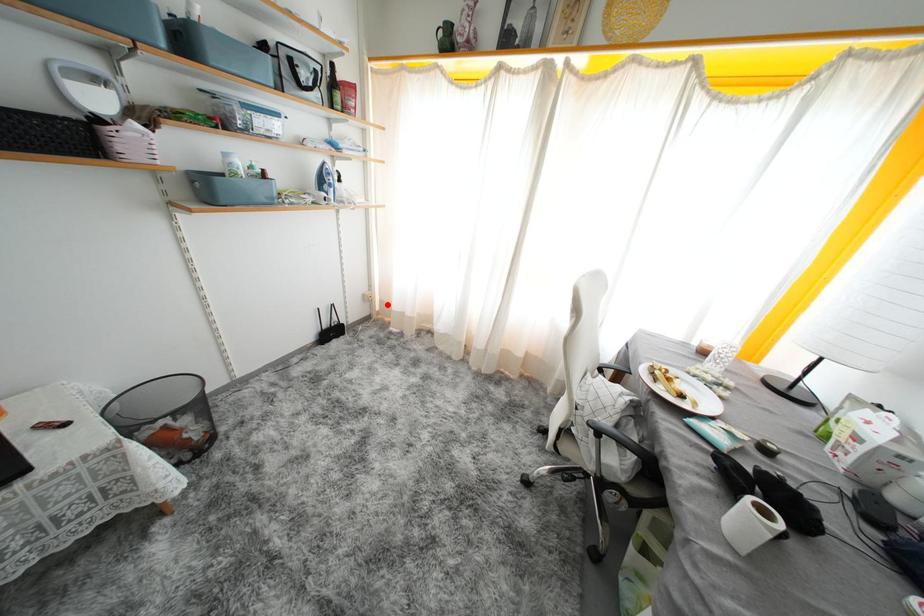
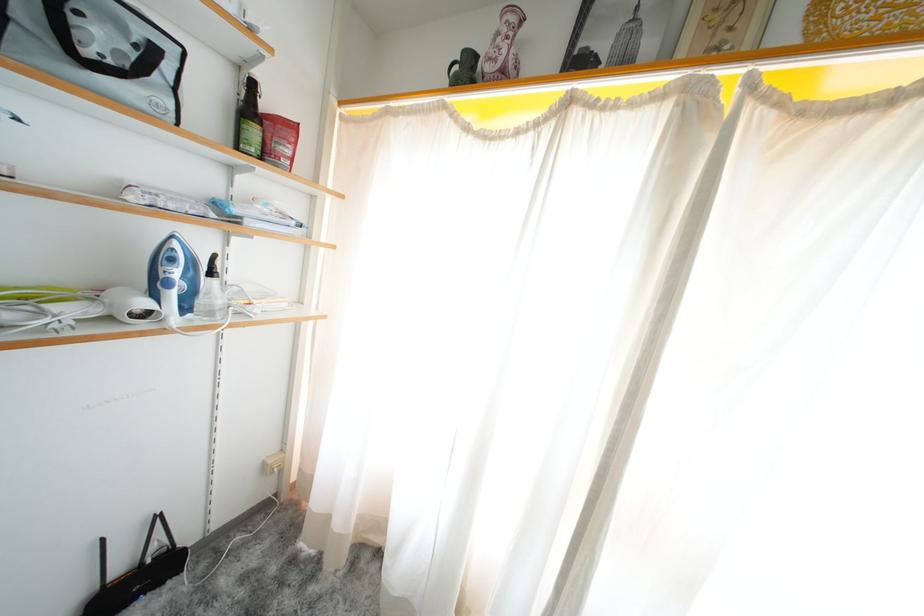
Question: A red point is marked in image1. In image2, is the corresponding 3D point closer to the camera or farther? Reply with the corresponding letter.

Choices:
 (A) The corresponding 3D point is closer.
 (B) The corresponding 3D point is farther.

Answer: (B)